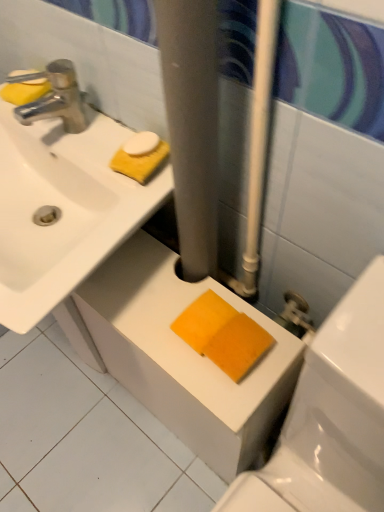
Identify the location of free spot to the right of chrome metallic faucet at upper left. This screenshot has height=512, width=384. (105, 136).